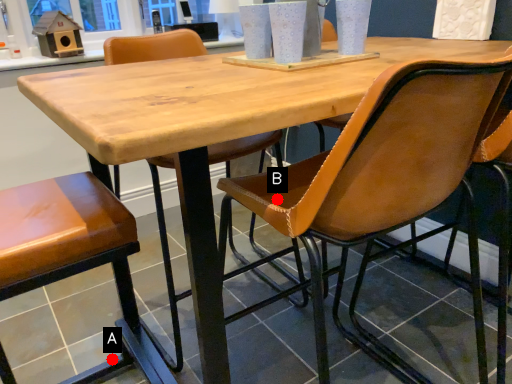
Question: Two points are circled on the image, labeled by A and B beside each circle. Which point is farther from the camera taking this photo?

Choices:
 (A) A is further
 (B) B is further

Answer: (A)